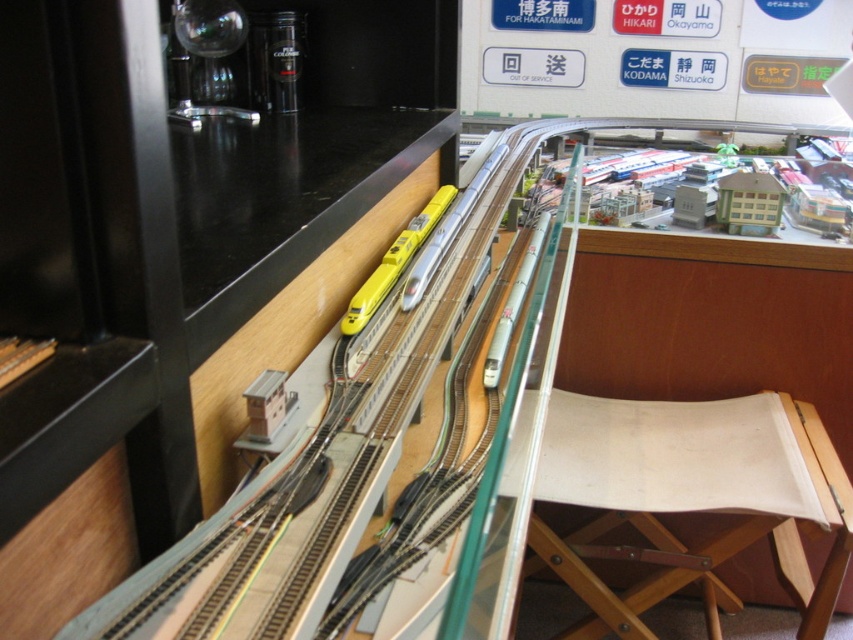
Is beige canvas chair at right shorter than black glossy counter top at upper left?

In fact, beige canvas chair at right may be taller than black glossy counter top at upper left.

Describe the element at coordinates (688, 499) in the screenshot. I see `beige canvas chair at right` at that location.

Between point (631, 550) and point (299, 268), which one is positioned in front?

Point (299, 268)

Where is `beige canvas chair at right`? beige canvas chair at right is located at coordinates (688, 499).

Measure the distance from beige canvas chair at right to silver metallic train at center.

29.99 inches

Can you confirm if beige canvas chair at right is wider than silver metallic train at center?

Correct, the width of beige canvas chair at right exceeds that of silver metallic train at center.

Between point (817, 614) and point (451, 230), which one is positioned in front?

Point (451, 230)

The height and width of the screenshot is (640, 853). I want to click on beige canvas chair at right, so click(x=688, y=499).

Is yellow matte train at center above silver metallic train at center?

Incorrect, yellow matte train at center is not positioned above silver metallic train at center.

Is yellow matte train at center smaller than silver metallic train at center?

Yes.

Measure the distance between point [428,227] and camera.

The distance of point [428,227] from camera is 1.24 meters.

Find the location of a particular element. Image resolution: width=853 pixels, height=640 pixels. yellow matte train at center is located at coordinates (393, 262).